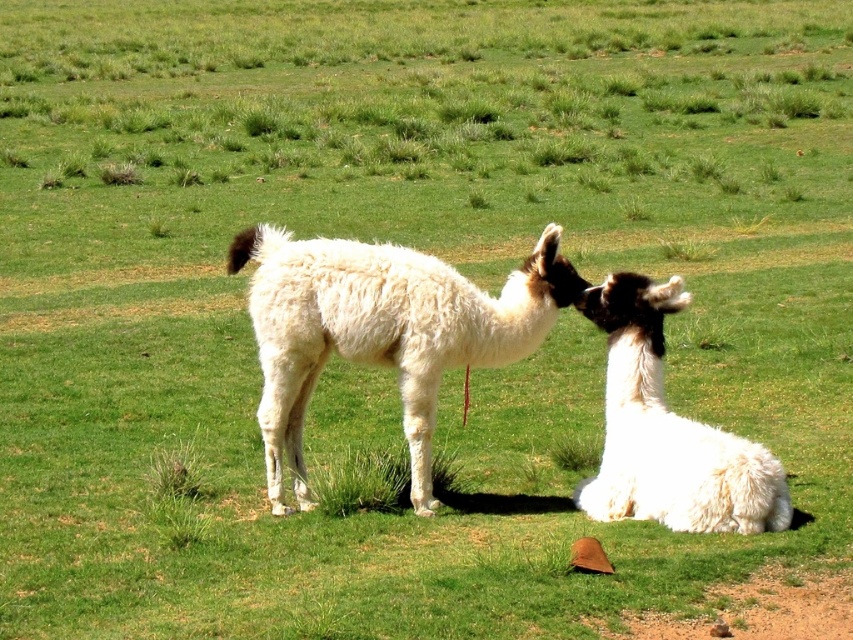
Question: Is white fluffy alpaca at center bigger than white fluffy alpaca at lower right?

Choices:
 (A) yes
 (B) no

Answer: (B)

Question: Which of the following is the farthest from the observer?

Choices:
 (A) white fluffy alpaca at lower right
 (B) white fluffy alpaca at center

Answer: (B)

Question: Which of the following is the closest to the observer?

Choices:
 (A) tap(633, 298)
 (B) tap(273, 490)

Answer: (A)

Question: Is white fluffy alpaca at center positioned behind white fluffy alpaca at lower right?

Choices:
 (A) yes
 (B) no

Answer: (A)

Question: Is the position of white fluffy alpaca at center less distant than that of white fluffy alpaca at lower right?

Choices:
 (A) yes
 (B) no

Answer: (B)

Question: Which point appears farthest from the camera in this image?

Choices:
 (A) (334, 305)
 (B) (636, 307)

Answer: (B)